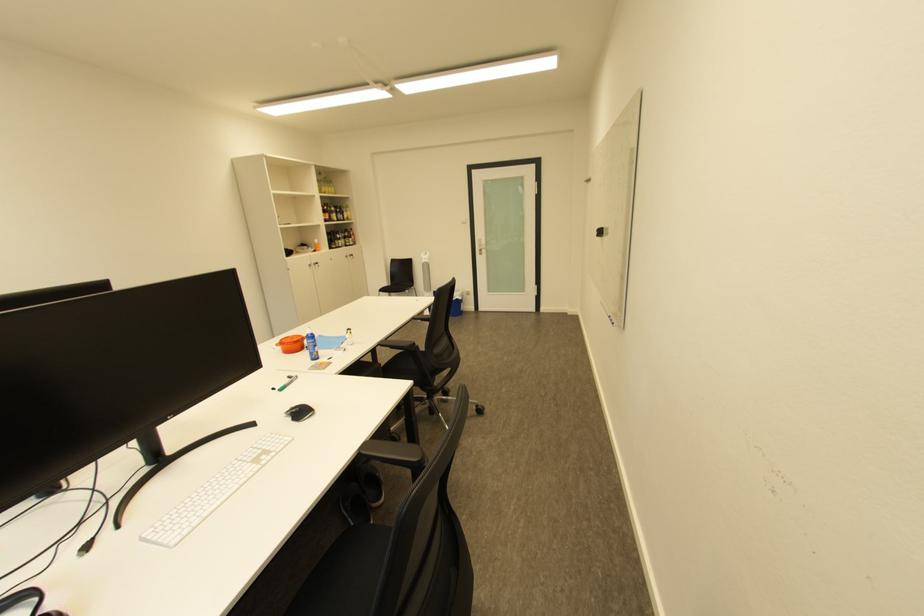
Where is `blue plastic bottle`? The height and width of the screenshot is (616, 924). blue plastic bottle is located at coordinates (310, 344).